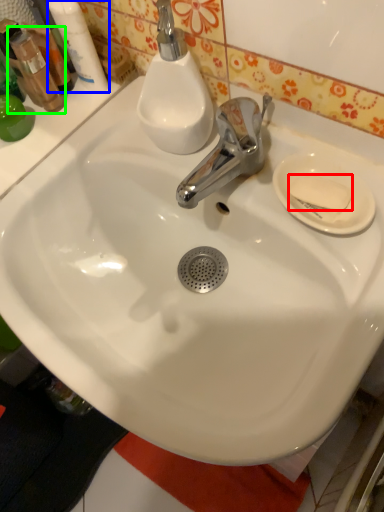
Question: Estimate the real-world distances between objects in this image. Which object is farther from soap (highlighted by a red box), mouthwash (highlighted by a blue box) or mouthwash (highlighted by a green box)?

Choices:
 (A) mouthwash
 (B) mouthwash

Answer: (B)